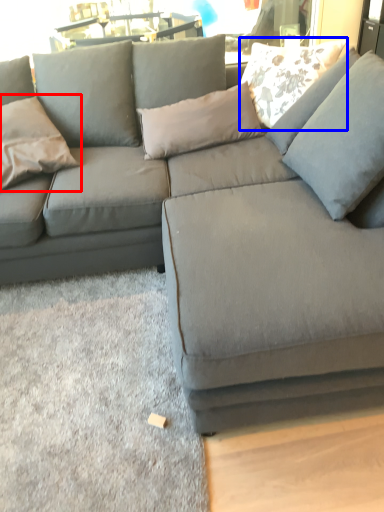
Question: Which point is further to the camera, pillow (highlighted by a red box) or pillow (highlighted by a blue box)?

Choices:
 (A) pillow
 (B) pillow

Answer: (B)